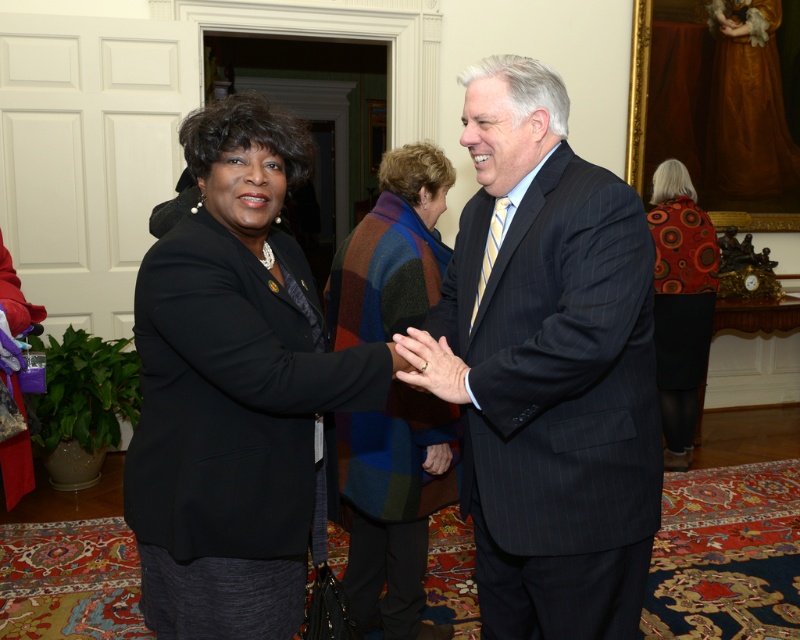
Which is above, dark blue pinstripe suit at center or matte black blazer at center?

dark blue pinstripe suit at center

This screenshot has height=640, width=800. I want to click on dark blue pinstripe suit at center, so click(548, 368).

Find the location of a particular element. This screenshot has height=640, width=800. dark blue pinstripe suit at center is located at coordinates (548, 368).

Between point (356, 413) and point (676, 388), which one is positioned in front?

Point (356, 413) is more forward.

Is point (396, 326) positioned behind point (686, 355)?

That is False.

Which is in front, point (426, 198) or point (666, 294)?

Positioned in front is point (426, 198).

This screenshot has width=800, height=640. Identify the location of multicolored woolen shawl at center. (394, 506).

Is dark blue pinstripe suit at center further to the viewer compared to orange patterned sweater at right?

That is False.

Which is behind, point (641, 452) or point (674, 221)?

The point (674, 221) is more distant.

Is point (512, 576) farther from camera compared to point (686, 308)?

No, (512, 576) is in front of (686, 308).

Identify the location of dark blue pinstripe suit at center. This screenshot has height=640, width=800. (548, 368).